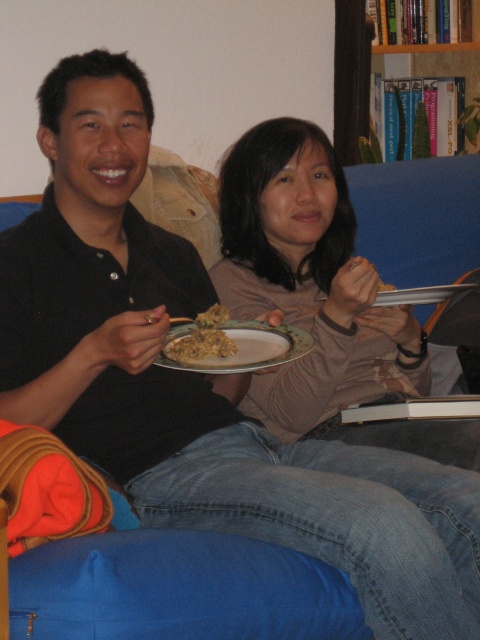
Question: Which of the following is the farthest from the observer?

Choices:
 (A) (253, 330)
 (B) (205, 332)
 (C) (351, 116)
 (D) (316, 436)

Answer: (C)

Question: Is matte ceramic plate at center above brown matte plate at center?

Choices:
 (A) no
 (B) yes

Answer: (A)

Question: Does matte pink sweater at center have a greater width compared to matte ceramic plate at center?

Choices:
 (A) yes
 (B) no

Answer: (A)

Question: Which of the following is the closest to the observer?

Choices:
 (A) brown matte plate at center
 (B) matte ceramic plate at center
 (C) matte pink sweater at center
 (D) hardcover books at upper center

Answer: (B)

Question: Among these objects, which one is nearest to the camera?

Choices:
 (A) hardcover books at upper center
 (B) matte pink sweater at center
 (C) brown matte plate at center
 (D) matte ceramic plate at center

Answer: (D)

Question: Is matte pink sweater at center closer to camera compared to brown matte plate at center?

Choices:
 (A) yes
 (B) no

Answer: (B)